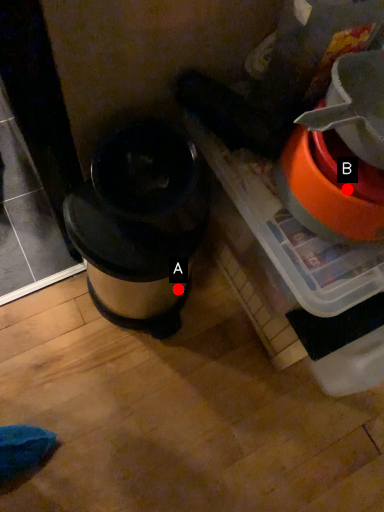
Question: Two points are circled on the image, labeled by A and B beside each circle. Which point appears closest to the camera in this image?

Choices:
 (A) A is closer
 (B) B is closer

Answer: (B)